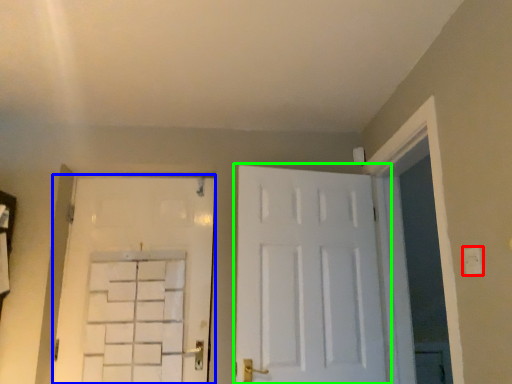
Question: Which is farther away from electric outlet (highlighted by a red box)? door (highlighted by a blue box) or door (highlighted by a green box)?

Choices:
 (A) door
 (B) door

Answer: (A)